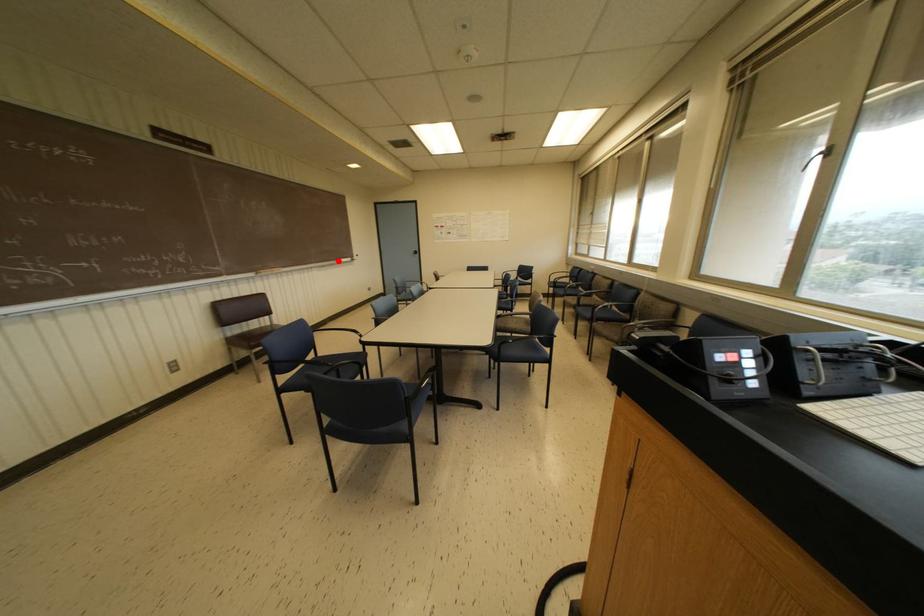
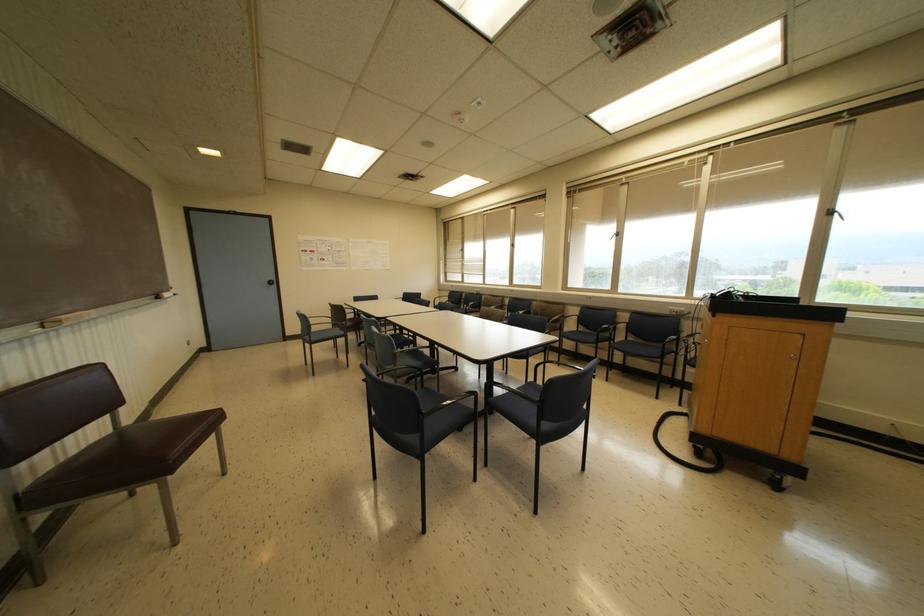
The point at the highlighted location is marked in the first image. Where is the corresponding point in the second image?

(157, 297)